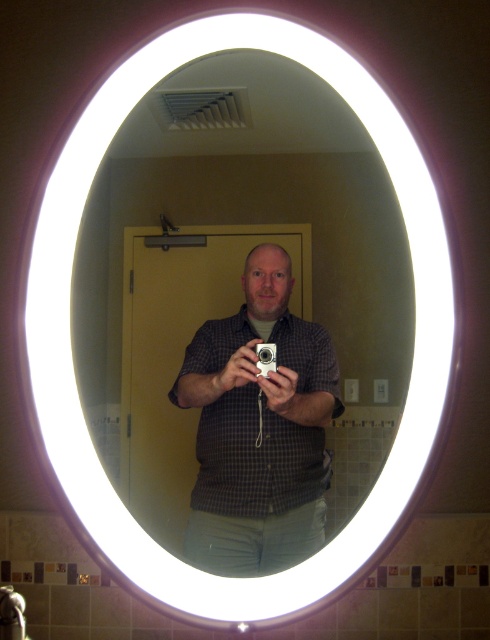
You are holding a camera and want to take a selfie using the mirror in the bathroom. The point where you need to focus the camera is at coordinates point (220,461). If the camera is currently 1.27 meters away from this point, should you move closer or farther away to get a better shot?

The camera is currently 1.27 meters away from the point (220,461). To get a better shot, you should move closer to reduce the distance between the camera and the point.

You are a photographer trying to capture a clear image of the checkered shirt at center and the silver metallic camera at center in the mirror selfie. Which object should you focus on first if you want the larger one to be in focus?

The checkered shirt at center has a larger size compared to the silver metallic camera at center, so you should focus on the checkered shirt at center first to ensure it is in focus.